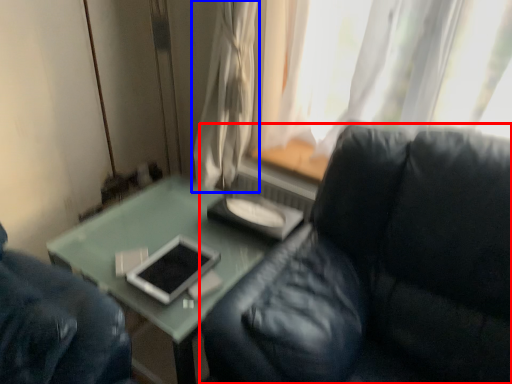
Question: Which object appears closest to the camera in this image, studio couch (highlighted by a red box) or curtain (highlighted by a blue box)?

Choices:
 (A) studio couch
 (B) curtain

Answer: (A)